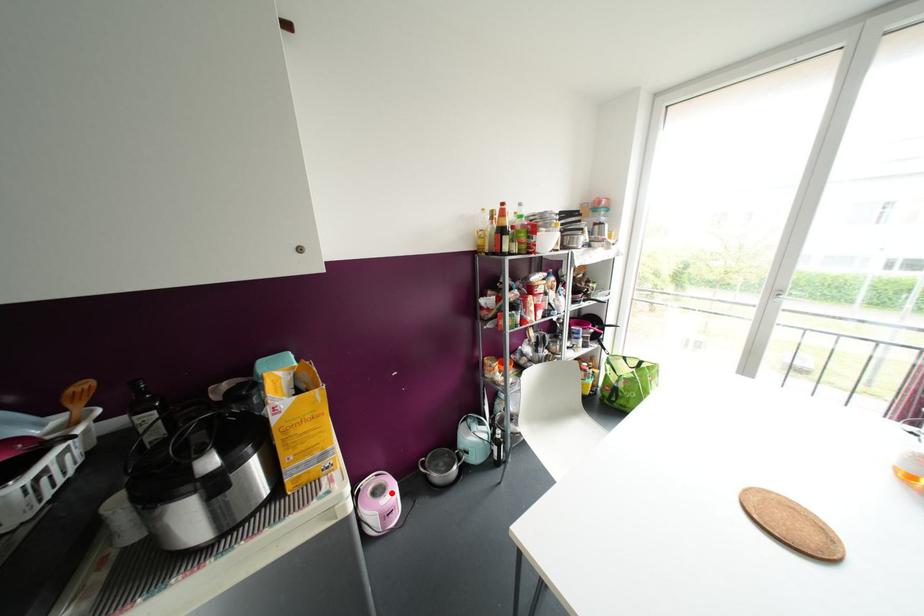
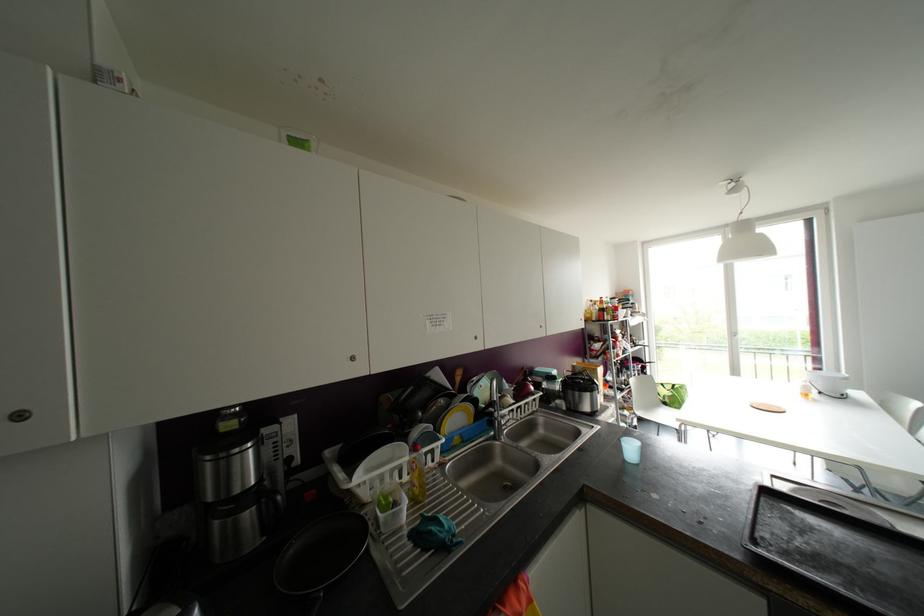
Question: I am providing you with two images of the same scene from different viewpoints. A red point is marked on the first image. Can you still see the location of the red point in image 2?

Choices:
 (A) Yes
 (B) No

Answer: (B)